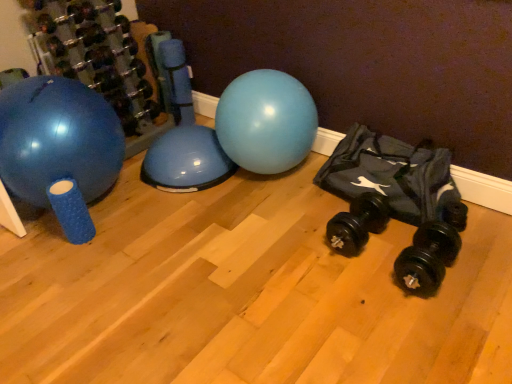
Question: Can you confirm if blue rubber ball at left is thinner than black fabric bean bag at right?

Choices:
 (A) no
 (B) yes

Answer: (A)

Question: Is blue rubber ball at left at the left side of black fabric bean bag at right?

Choices:
 (A) yes
 (B) no

Answer: (A)

Question: Does blue rubber ball at left have a greater width compared to black fabric bean bag at right?

Choices:
 (A) no
 (B) yes

Answer: (B)

Question: From the image's perspective, does blue rubber ball at left appear lower than black fabric bean bag at right?

Choices:
 (A) yes
 (B) no

Answer: (B)

Question: From a real-world perspective, is blue rubber ball at left on top of black fabric bean bag at right?

Choices:
 (A) no
 (B) yes

Answer: (B)

Question: Considering the positions of point (81, 163) and point (437, 256), is point (81, 163) closer or farther from the camera than point (437, 256)?

Choices:
 (A) farther
 (B) closer

Answer: (A)

Question: Considering the positions of blue rubber ball at left and black rubber dumbbell at lower right, the 3th dumbbell when ordered from left to right, in the image, is blue rubber ball at left taller or shorter than black rubber dumbbell at lower right, the 3th dumbbell when ordered from left to right,?

Choices:
 (A) tall
 (B) short

Answer: (A)

Question: Is blue rubber ball at left to the left or to the right of black rubber dumbbell at lower right, the 3th dumbbell when ordered from left to right, in the image?

Choices:
 (A) left
 (B) right

Answer: (A)

Question: Is blue rubber ball at left spatially inside black rubber dumbbell at lower right, which ranks as the first dumbbell in front-to-back order, or outside of it?

Choices:
 (A) inside
 (B) outside

Answer: (B)

Question: Considering the positions of black rubber dumbbell at lower right, the 3th dumbbell when ordered from left to right, and black fabric bean bag at right in the image, is black rubber dumbbell at lower right, the 3th dumbbell when ordered from left to right, taller or shorter than black fabric bean bag at right?

Choices:
 (A) tall
 (B) short

Answer: (B)

Question: From a real-world perspective, is black rubber dumbbell at lower right, the 3th dumbbell when ordered from left to right, physically located above or below black fabric bean bag at right?

Choices:
 (A) above
 (B) below

Answer: (B)

Question: Is black rubber dumbbell at lower right, the 3th dumbbell when ordered from left to right, bigger or smaller than black fabric bean bag at right?

Choices:
 (A) small
 (B) big

Answer: (A)

Question: Does point (406, 246) appear closer or farther from the camera than point (422, 195)?

Choices:
 (A) farther
 (B) closer

Answer: (B)

Question: In terms of size, does black rubber dumbbell at lower right, positioned as the 2th dumbbell in bottom-to-top order, appear bigger or smaller than blue rubber ball at left?

Choices:
 (A) big
 (B) small

Answer: (B)

Question: Which is correct: black rubber dumbbell at lower right, acting as the 2th dumbbell starting from the back, is inside blue rubber ball at left, or outside of it?

Choices:
 (A) outside
 (B) inside

Answer: (A)